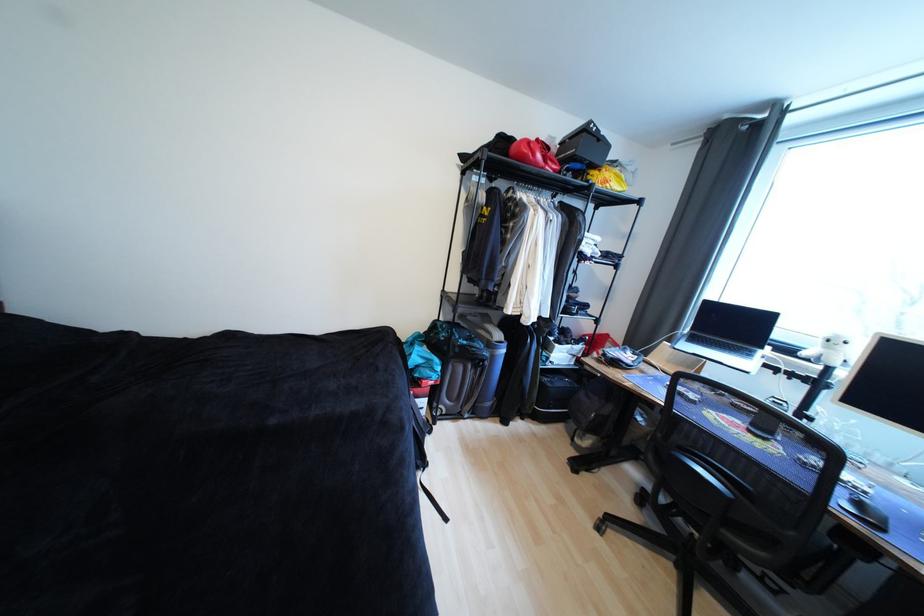
What do you see at coordinates (533, 154) in the screenshot? I see `the red gym bag` at bounding box center [533, 154].